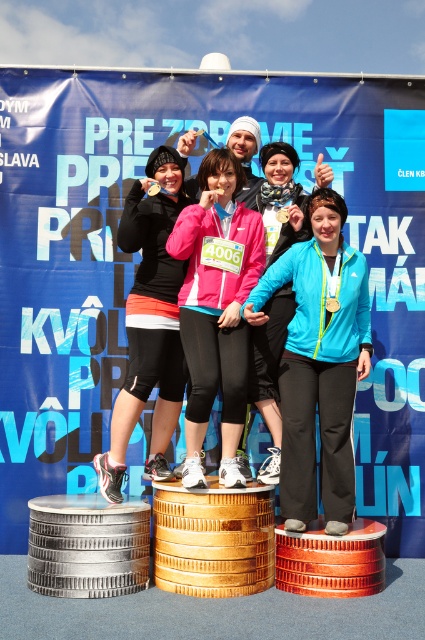
Where is `matte black jacket at center`? matte black jacket at center is located at coordinates (150, 323).

Does matte black jacket at center lie behind matte pink jacket at center?

No, matte black jacket at center is in front of matte pink jacket at center.

Between point (164, 412) and point (260, 150), which one is positioned behind?

The point (260, 150) is more distant.

Locate an element on the screen. Image resolution: width=425 pixels, height=640 pixels. matte black jacket at center is located at coordinates (150, 323).

Does pink fabric jacket at center appear on the left side of matte black jacket at center?

In fact, pink fabric jacket at center is to the right of matte black jacket at center.

Does pink fabric jacket at center have a smaller size compared to matte black jacket at center?

Answer: No, pink fabric jacket at center is not smaller than matte black jacket at center.

Identify the location of pink fabric jacket at center. (215, 307).

Locate an element on the screen. The image size is (425, 640). pink fabric jacket at center is located at coordinates (215, 307).

Does pink fabric jacket at center have a smaller size compared to matte pink jacket at center?

Actually, pink fabric jacket at center might be larger than matte pink jacket at center.

Between point (195, 445) and point (266, 182), which one is positioned behind?

Point (266, 182)

Where is `pink fabric jacket at center`? pink fabric jacket at center is located at coordinates (215, 307).